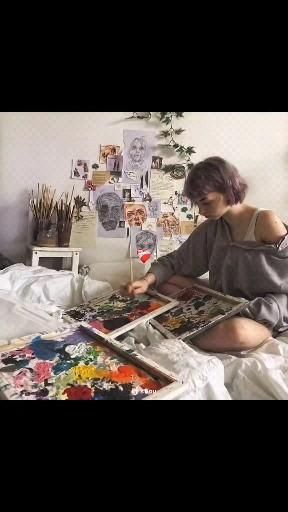
At what (x,y) coordinates should I click in order to perform the action: click on table legs. Please return your answer as a coordinate pair (x, y). Looking at the image, I should click on (27, 259), (34, 259), (66, 261), (76, 269).